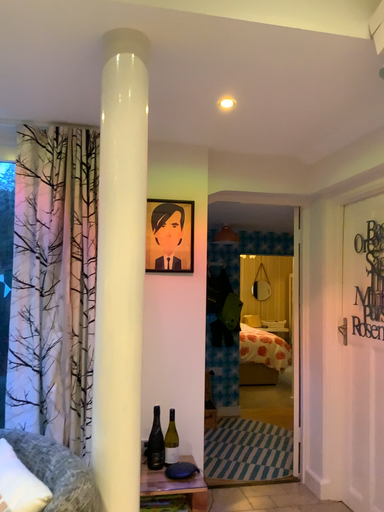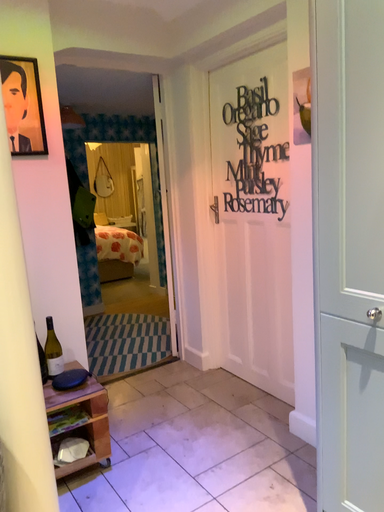
Question: Which way did the camera rotate in the video?

Choices:
 (A) rotated downward
 (B) rotated upward

Answer: (A)